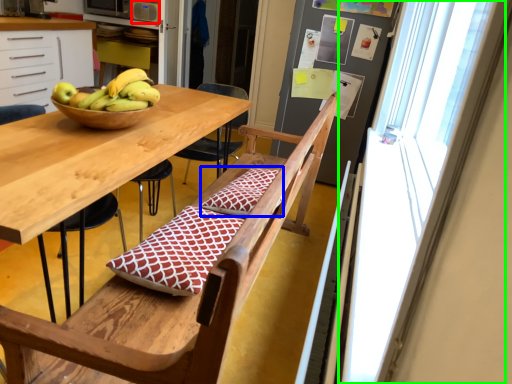
Question: Which is nearer to the appliance (highlighted by a red box)? pillow (highlighted by a blue box) or window screen (highlighted by a green box).

Choices:
 (A) pillow
 (B) window screen

Answer: (A)